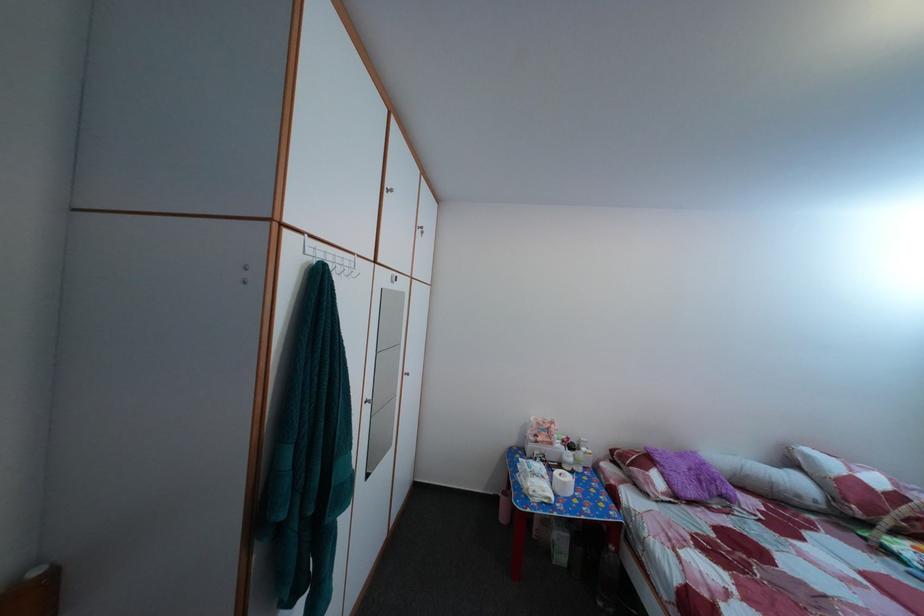
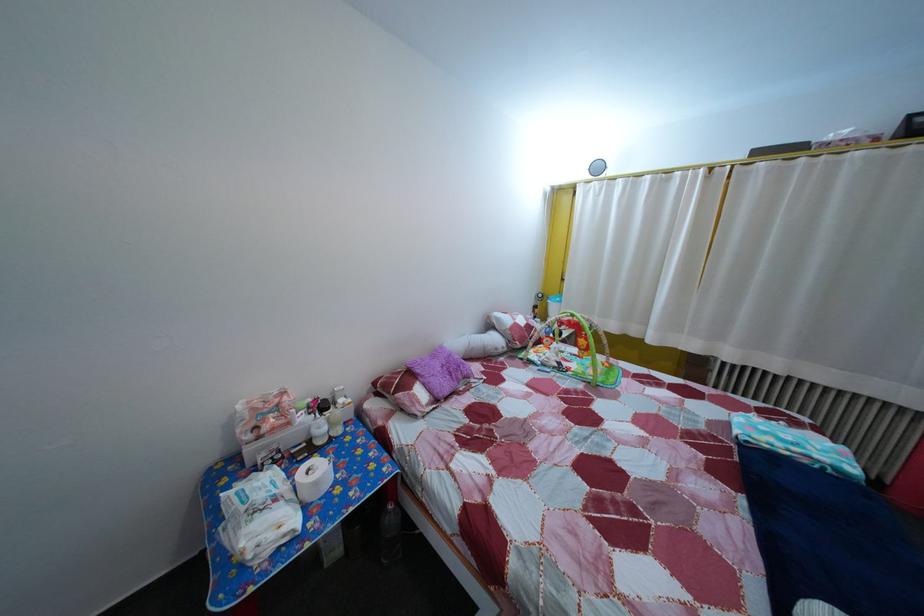
Find the pixel in the second image that matches point (574, 492) in the first image.

(325, 491)